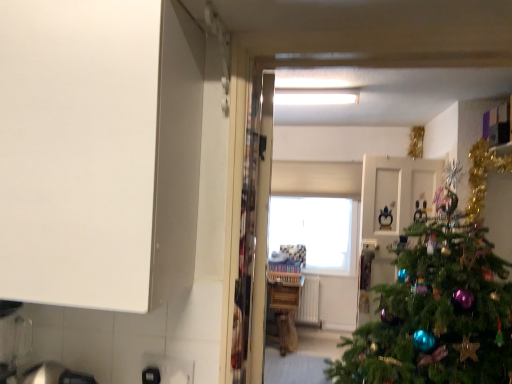
Question: Is transparent glass window at center beside white glossy door at center?

Choices:
 (A) yes
 (B) no

Answer: (B)

Question: Is transparent glass window at center to the left of white glossy door at center from the viewer's perspective?

Choices:
 (A) no
 (B) yes

Answer: (B)

Question: Can you confirm if transparent glass window at center is shorter than white glossy door at center?

Choices:
 (A) no
 (B) yes

Answer: (B)

Question: Is the depth of transparent glass window at center greater than that of white glossy door at center?

Choices:
 (A) yes
 (B) no

Answer: (B)

Question: Would you consider transparent glass window at center to be distant from white glossy door at center?

Choices:
 (A) no
 (B) yes

Answer: (B)

Question: Considering the positions of point (423, 246) and point (284, 314), is point (423, 246) closer or farther from the camera than point (284, 314)?

Choices:
 (A) farther
 (B) closer

Answer: (B)

Question: From the image's perspective, is green matte christmas tree at right located above or below wooden counter at center?

Choices:
 (A) above
 (B) below

Answer: (A)

Question: Is green matte christmas tree at right to the left or to the right of wooden counter at center in the image?

Choices:
 (A) left
 (B) right

Answer: (B)

Question: Considering the positions of green matte christmas tree at right and wooden counter at center in the image, is green matte christmas tree at right wider or thinner than wooden counter at center?

Choices:
 (A) wide
 (B) thin

Answer: (B)

Question: Would you say white glossy door at center is inside or outside transparent glass window at center?

Choices:
 (A) inside
 (B) outside

Answer: (B)

Question: Is white glossy door at center wider or thinner than transparent glass window at center?

Choices:
 (A) wide
 (B) thin

Answer: (A)

Question: From the image's perspective, is white glossy door at center above or below transparent glass window at center?

Choices:
 (A) above
 (B) below

Answer: (B)

Question: Considering the positions of white glossy door at center and transparent glass window at center in the image, is white glossy door at center bigger or smaller than transparent glass window at center?

Choices:
 (A) small
 (B) big

Answer: (B)

Question: Is white glossy door at center wider or thinner than wooden counter at center?

Choices:
 (A) wide
 (B) thin

Answer: (B)

Question: Considering their positions, is white glossy door at center located in front of or behind wooden counter at center?

Choices:
 (A) front
 (B) behind

Answer: (B)